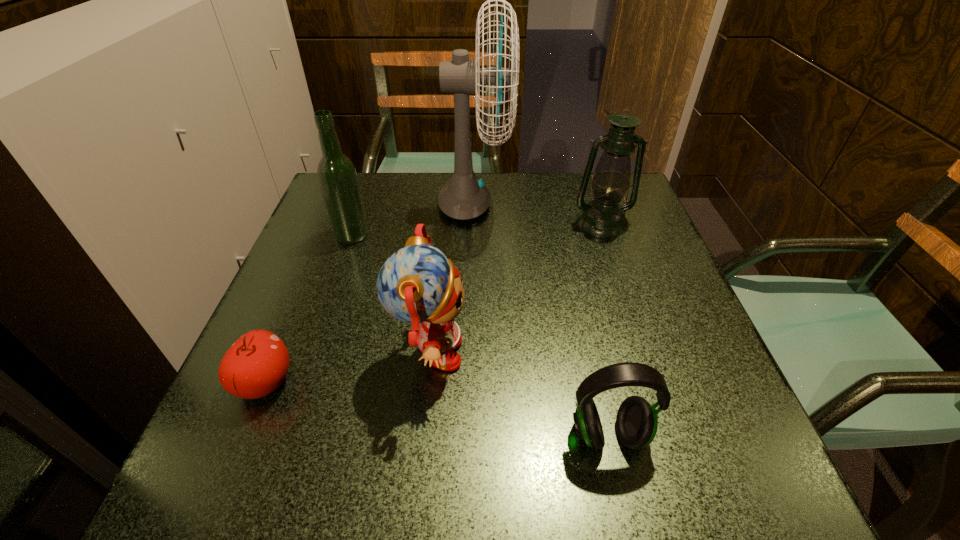
The height and width of the screenshot is (540, 960). I want to click on free space located on the back of the apple, so click(319, 252).

Find the location of a particular element. The image size is (960, 540). fan that is positioned at the far edge is located at coordinates (464, 197).

Identify the location of oil lamp that is at the far edge. The image size is (960, 540). (603, 216).

You are a GUI agent. You are given a task and a screenshot of the screen. Output one action in this format:
    pyautogui.click(x=<x>, y=<y>)
    Task: Click on the object positioned at the near edge
    The height and width of the screenshot is (540, 960).
    Given the screenshot: What is the action you would take?
    pyautogui.click(x=636, y=422)

Find the location of a particular element. This screenshot has width=960, height=540. liquor at the left edge is located at coordinates (337, 176).

The height and width of the screenshot is (540, 960). I want to click on apple that is positioned at the left edge, so click(x=257, y=363).

Where is `oil lamp at the right edge`? The height and width of the screenshot is (540, 960). oil lamp at the right edge is located at coordinates [603, 216].

The height and width of the screenshot is (540, 960). In order to click on headset positioned at the right edge in this screenshot , I will do `click(636, 422)`.

Find the location of a particular element. The height and width of the screenshot is (540, 960). object at the far right corner is located at coordinates (603, 216).

The image size is (960, 540). Find the location of `object located in the near right corner section of the desktop`. object located in the near right corner section of the desktop is located at coordinates [636, 422].